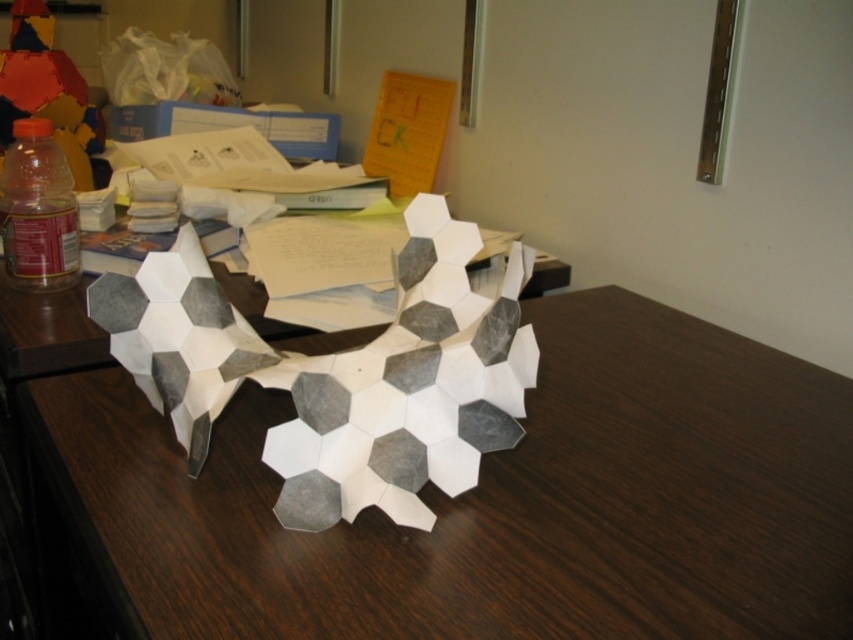
Find the location of a particular element. The height and width of the screenshot is (640, 853). white wood table at center is located at coordinates (474, 502).

Is white wood table at center to the left of translucent plastic bottle at left from the viewer's perspective?

Incorrect, white wood table at center is not on the left side of translucent plastic bottle at left.

This screenshot has width=853, height=640. What are the coordinates of `white wood table at center` in the screenshot? It's located at point(474,502).